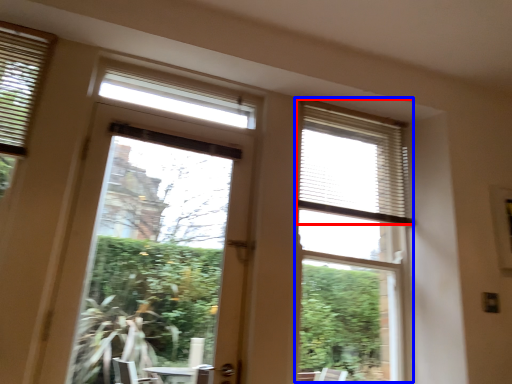
Question: Which object is closer to the camera taking this photo, blind (highlighted by a red box) or bay window (highlighted by a blue box)?

Choices:
 (A) blind
 (B) bay window

Answer: (B)